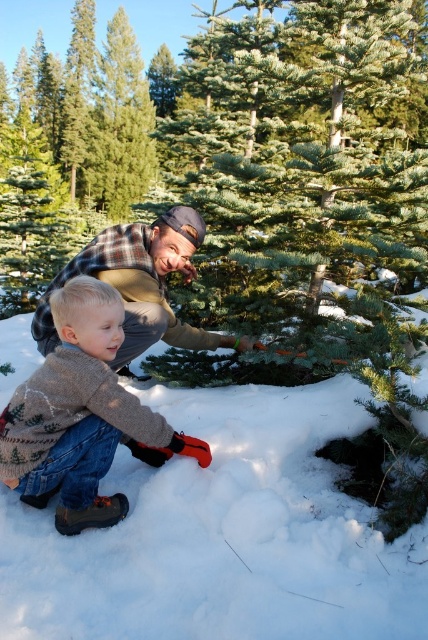
What do you see at coordinates (312, 214) in the screenshot? The image size is (428, 640). I see `green matte christmas tree at center` at bounding box center [312, 214].

You are a GUI agent. You are given a task and a screenshot of the screen. Output one action in this format:
    pyautogui.click(x=<x>, y=<y>)
    Task: Click on the green matte christmas tree at center
    The width and height of the screenshot is (428, 640).
    Given the screenshot: What is the action you would take?
    pyautogui.click(x=312, y=214)

Where is `green matte christmas tree at center`? This screenshot has width=428, height=640. green matte christmas tree at center is located at coordinates (312, 214).

Does green matte christmas tree at center have a greater width compared to knitted sweater at lower left?

Correct, the width of green matte christmas tree at center exceeds that of knitted sweater at lower left.

Does point (273, 198) come farther from viewer compared to point (62, 420)?

Yes, point (273, 198) is farther from viewer.

Identify the location of green matte christmas tree at center. This screenshot has width=428, height=640. (312, 214).

Does knitted sweater at lower left lie behind plaid flannel shirt at center?

No, knitted sweater at lower left is closer to the viewer.

Between knitted sweater at lower left and plaid flannel shirt at center, which one is positioned lower?

knitted sweater at lower left is below.

Is point (112, 416) closer to viewer compared to point (202, 333)?

Yes, it is in front of point (202, 333).

At what (x,y) coordinates should I click in order to perform the action: click on knitted sweater at lower left. Please return your answer as a coordinate pair (x, y). The width and height of the screenshot is (428, 640). Looking at the image, I should click on (80, 413).